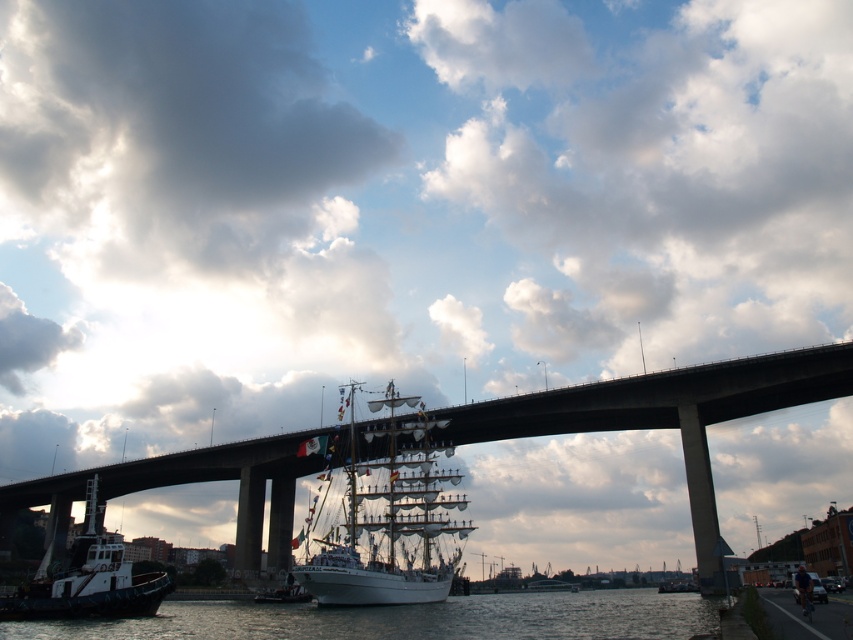
You are a photographer planning to take a photo of the waterfront scene. You want to ensure that both the concrete bridge at center and the white wooden ship at center are clearly visible in your shot. Based on their sizes, which object should you position closer to the edge of the frame to avoid overcrowding the composition?

The concrete bridge at center might be wider than the white wooden ship at center, so positioning the bridge closer to the edge of the frame would help avoid overcrowding the composition since it occupies more space.

You are a tour guide leading a group near the waterfront. You want to move from the white matte tugboat at lower left to the clear water at lower center. Is the distance between them sufficient for a 40 meter long tour bus to pass through without any adjustments?

The distance between the clear water at lower center and the white matte tugboat at lower left is 40.02 meters, which is just enough for the 40 meter long tour bus to pass through without any adjustments.

You are a photographer planning to capture the waterfront scene. You want to ensure that the white matte tugboat at lower left is framed to the left of the clear water at lower center. Based on their relative widths, which object should you adjust your camera angle to prioritize in the frame?

The clear water at lower center is wider than the white matte tugboat at lower left. To frame the tugboat to the left of the water, you should adjust your camera angle to prioritize including more of the clear water at lower center since it is wider and requires more space in the composition.